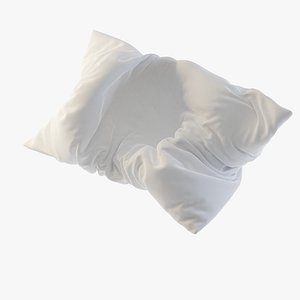
Where is `lower left corner of the pillow`? lower left corner of the pillow is located at coordinates (30, 142).